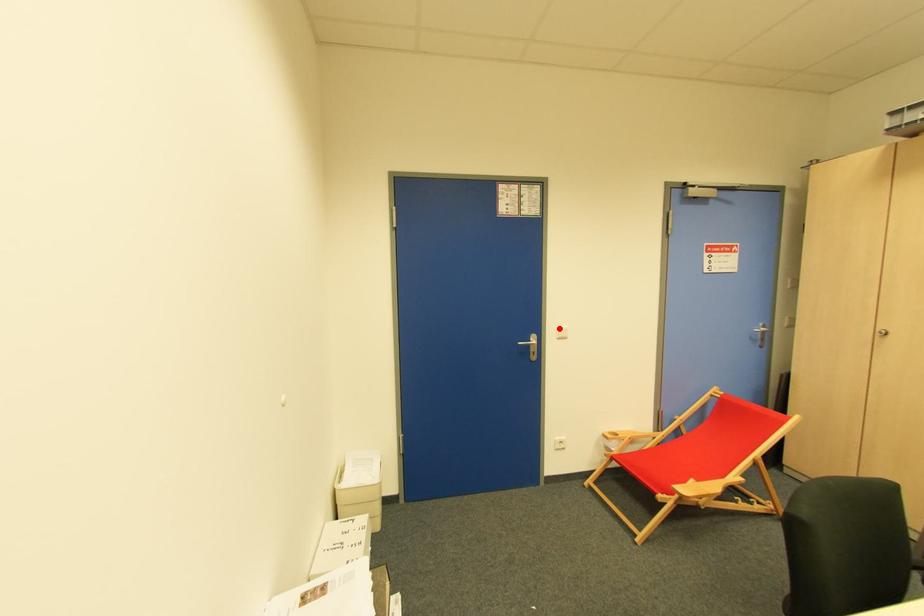
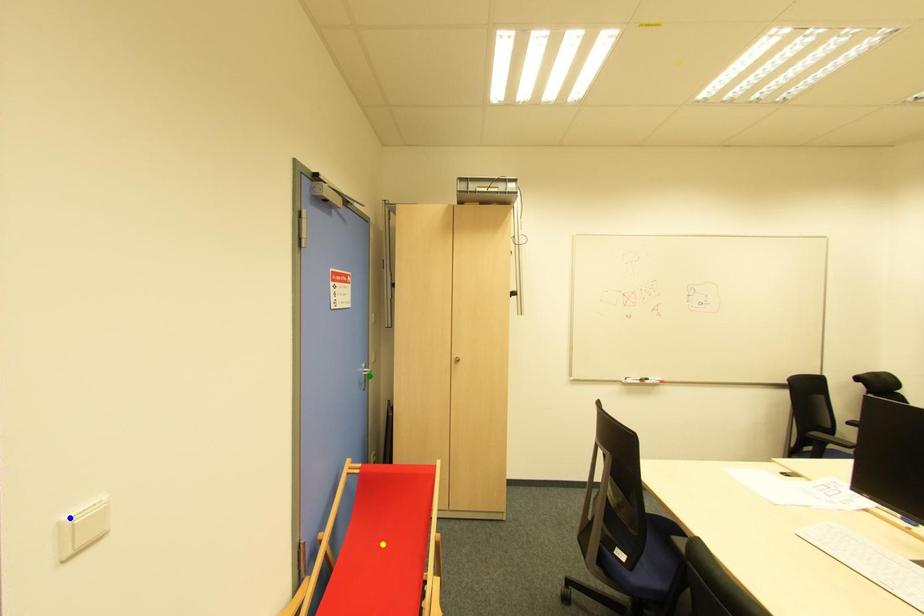
Question: I am providing you with two images of the same scene from different viewpoints. A red point is marked on the first image. You are given multiple points on the second image. Which point in image 2 is actually the same real-world point as the red point in image 1?

Choices:
 (A) yellow point
 (B) blue point
 (C) green point

Answer: (B)